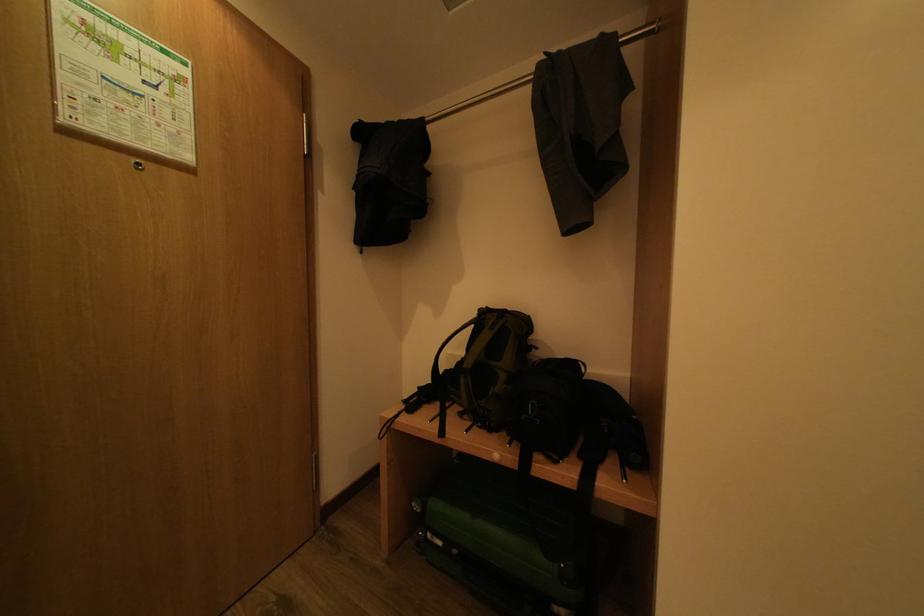
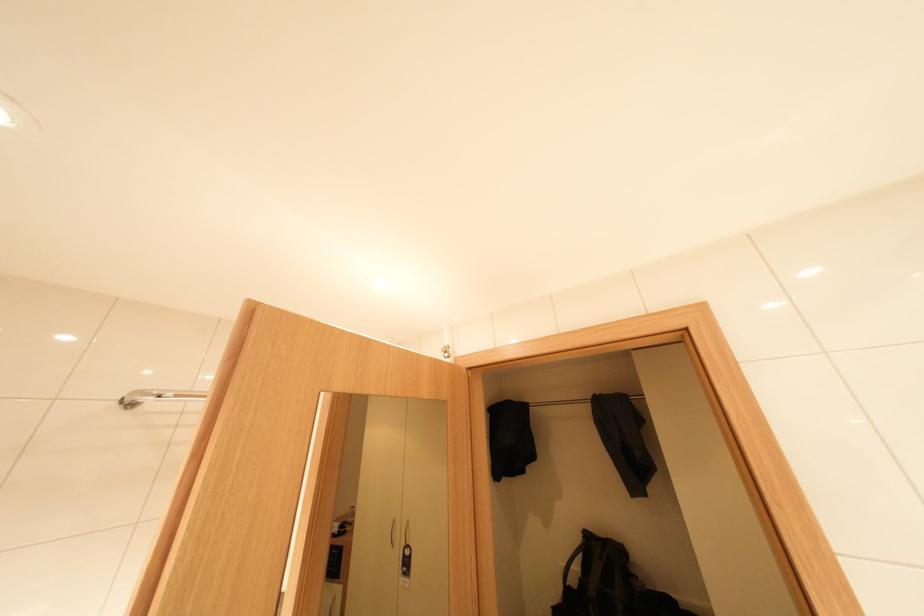
Question: The images are taken continuously from a first-person perspective. In which direction are you moving?

Choices:
 (A) Left
 (B) Right
 (C) Forward
 (D) Backward

Answer: (D)